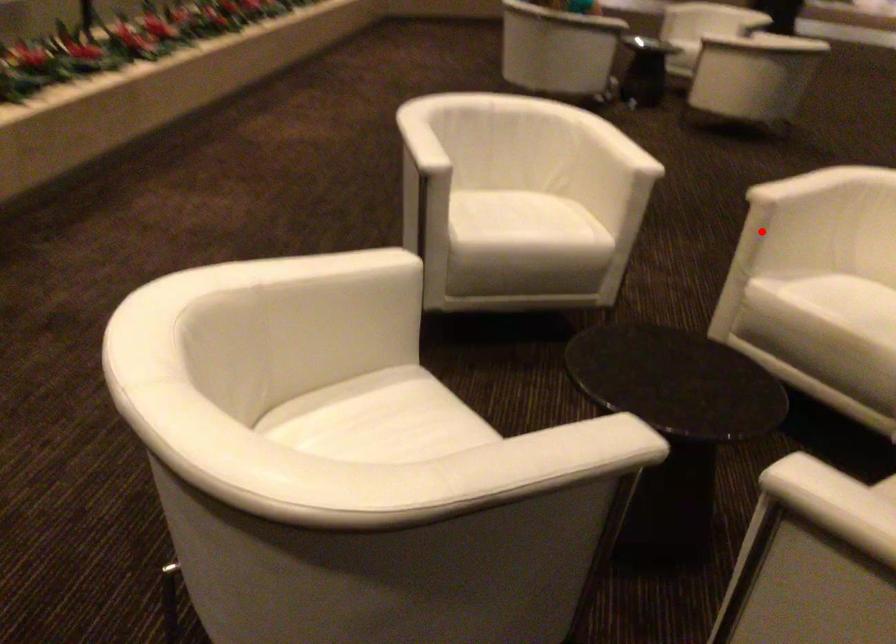
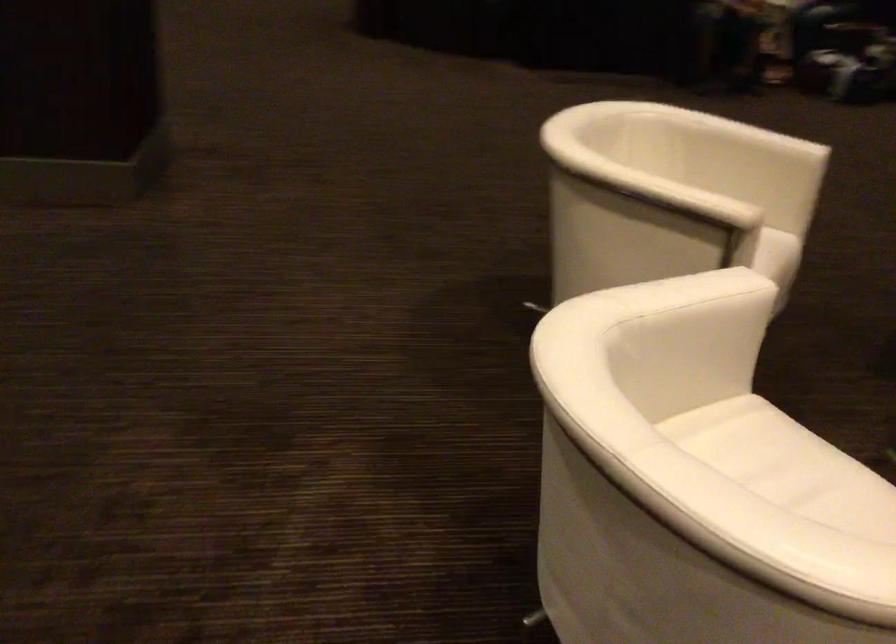
In the second image, find the point that corresponds to the highlighted location in the first image.

(676, 261)